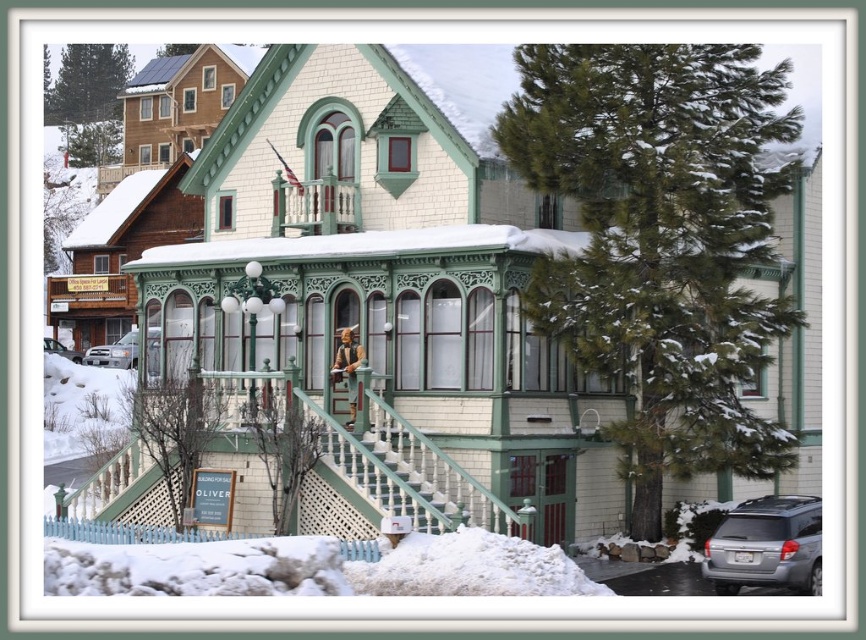
You are a delivery driver approaching the house. You need to park your vehicle between the silver metallic suv at lower right and the silver metallic sedan at lower left. Is there enough space to park your vehicle in between them?

The silver metallic suv at lower right is in front of the silver metallic sedan at lower left, so there is no space between them to park your vehicle.

You are standing in front of the Victorian house and notice two points marked on the image. The first point is at coordinate point (x=369, y=465) and the second is at point (x=157, y=353). Which of these points is closer to your current position?

Point (x=369, y=465) is closer to the camera than point (x=157, y=353), so the first point is closer to your current position.